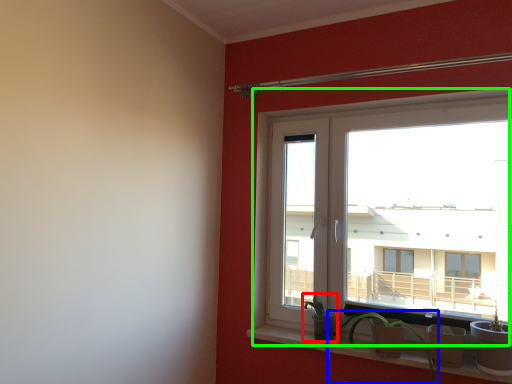
Question: Which object is the farthest from plant (highlighted by a red box)? Choose among these: houseplant (highlighted by a blue box) or window (highlighted by a green box).

Choices:
 (A) houseplant
 (B) window

Answer: (B)